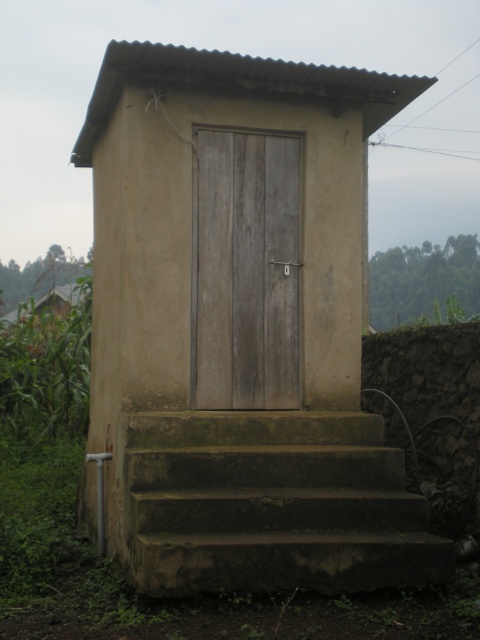
Which is more to the right, green mossy concrete stairs at lower center or weathered wood door at center?

From the viewer's perspective, green mossy concrete stairs at lower center appears more on the right side.

How far apart are green mossy concrete stairs at lower center and weathered wood door at center?

green mossy concrete stairs at lower center is 35.95 inches from weathered wood door at center.

Does point (282, 554) come behind point (241, 250)?

No, (282, 554) is in front of (241, 250).

Identify the location of green mossy concrete stairs at lower center. (272, 504).

Is brown matte door at center to the left of green mossy concrete stairs at lower center from the viewer's perspective?

Correct, you'll find brown matte door at center to the left of green mossy concrete stairs at lower center.

Who is lower down, brown matte door at center or green mossy concrete stairs at lower center?

green mossy concrete stairs at lower center

I want to click on brown matte door at center, so click(240, 324).

Does brown matte door at center have a larger size compared to weathered wood door at center?

Correct, brown matte door at center is larger in size than weathered wood door at center.

Is brown matte door at center shorter than weathered wood door at center?

In fact, brown matte door at center may be taller than weathered wood door at center.

Is point (135, 508) more distant than point (280, 387)?

No, (135, 508) is closer to viewer.

The image size is (480, 640). Identify the location of brown matte door at center. (240, 324).